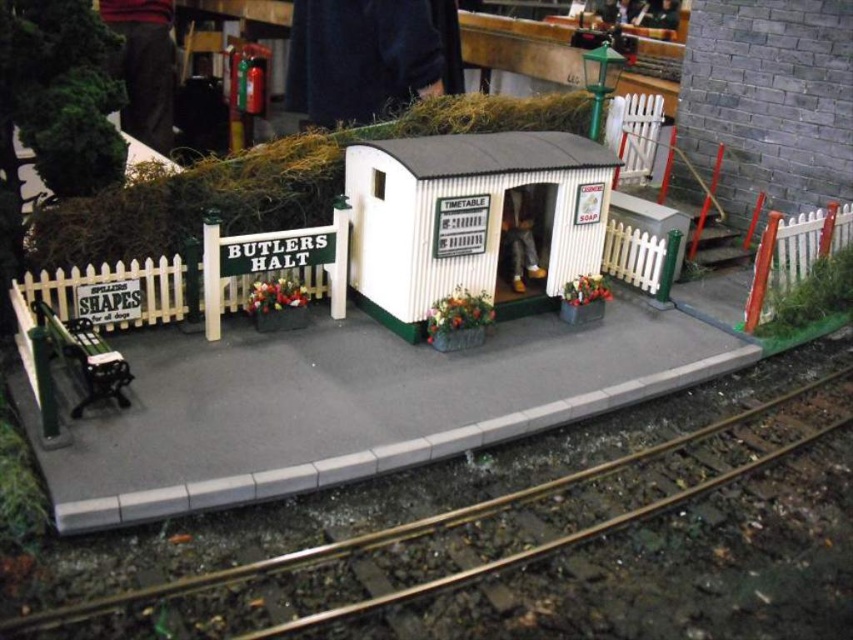
Consider the image. Can you confirm if white corrugated metal hut at center is positioned to the left of metallic gold track at lower center?

In fact, white corrugated metal hut at center is to the right of metallic gold track at lower center.

Between white corrugated metal hut at center and metallic gold track at lower center, which one is positioned higher?

white corrugated metal hut at center

The height and width of the screenshot is (640, 853). Identify the location of white corrugated metal hut at center. (473, 221).